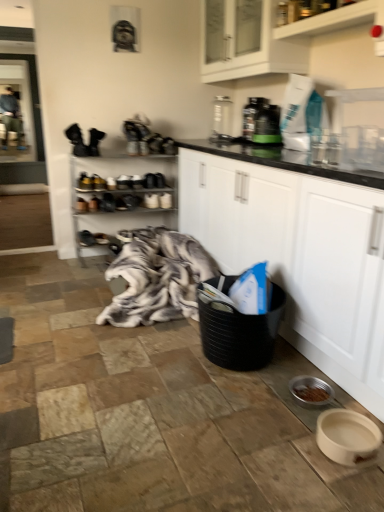
The height and width of the screenshot is (512, 384). Describe the element at coordinates (267, 125) in the screenshot. I see `green plastic bottle at upper center, arranged as the 2th appliance when viewed from the left` at that location.

You are a GUI agent. You are given a task and a screenshot of the screen. Output one action in this format:
    pyautogui.click(x=<x>, y=<y>)
    Task: Click on the white matte cabinet at center, arranged as the second cabinetry when viewed from the top
    
    Given the screenshot: What is the action you would take?
    pyautogui.click(x=298, y=253)

In order to face black woven laundry basket at lower center, should I rotate leftwards or rightwards?

Turn right approximately 7.427 degrees to face it.

The height and width of the screenshot is (512, 384). What do you see at coordinates (119, 197) in the screenshot?
I see `metallic silver shoe rack at center, placed as the first shelf when sorted from left to right` at bounding box center [119, 197].

Measure the distance between point (177, 276) and camera.

Point (177, 276) and camera are 2.68 meters apart from each other.

This screenshot has height=512, width=384. I want to click on green plastic bottle at upper center, marked as the first appliance in a front-to-back arrangement, so [x=267, y=125].

How many degrees apart are the facing directions of green plastic bottle at upper center, the 2th appliance viewed from the back, and clear glass screen door at upper left?

90.2 degrees separate the facing orientations of green plastic bottle at upper center, the 2th appliance viewed from the back, and clear glass screen door at upper left.

Would you consider green plastic bottle at upper center, arranged as the 2th appliance when viewed from the left, to be distant from clear glass screen door at upper left?

green plastic bottle at upper center, arranged as the 2th appliance when viewed from the left, is positioned a significant distance from clear glass screen door at upper left.

Where is `screen door above the green plastic bottle at upper center, marked as the first appliance in a front-to-back arrangement (from a real-world perspective)`? screen door above the green plastic bottle at upper center, marked as the first appliance in a front-to-back arrangement (from a real-world perspective) is located at coordinates pyautogui.click(x=16, y=112).

Does green plastic bottle at upper center, the 2th appliance viewed from the back, turn towards clear glass screen door at upper left?

No, green plastic bottle at upper center, the 2th appliance viewed from the back, is not oriented towards clear glass screen door at upper left.

Does black woven laundry basket at lower center come behind white glossy cabinet at upper center, positioned as the first cabinetry in top-to-bottom order?

No.

In the image, is black woven laundry basket at lower center on the left side or the right side of white glossy cabinet at upper center, positioned as the first cabinetry in top-to-bottom order?

Based on their positions, black woven laundry basket at lower center is located to the left of white glossy cabinet at upper center, positioned as the first cabinetry in top-to-bottom order.

Is black woven laundry basket at lower center next to white glossy cabinet at upper center, positioned as the first cabinetry in top-to-bottom order, and touching it?

No, black woven laundry basket at lower center is not touching white glossy cabinet at upper center, positioned as the first cabinetry in top-to-bottom order.

Does black woven laundry basket at lower center turn towards white glossy cabinet at upper center, positioned as the first cabinetry in top-to-bottom order?

No.

Consider the image. Which point is more forward, (222, 348) or (137, 287)?

The point (222, 348) is more forward.

In the image, is black woven laundry basket at lower center positioned in front of or behind fluffy gray blanket at center?

Visually, black woven laundry basket at lower center is located in front of fluffy gray blanket at center.

Can you tell me how much black woven laundry basket at lower center and fluffy gray blanket at center differ in facing direction?

black woven laundry basket at lower center and fluffy gray blanket at center are facing 12.9 degrees away from each other.

Would you say fluffy gray blanket at center is part of black woven laundry basket at lower center's contents?

Definitely not — fluffy gray blanket at center is not inside black woven laundry basket at lower center.

Is metallic silver shoe rack at center, placed as the first shelf when sorted from left to right, looking in the opposite direction of fluffy gray blanket at center?

That's not correct — metallic silver shoe rack at center, placed as the first shelf when sorted from left to right, is not looking away from fluffy gray blanket at center.

Based on the photo, from a real-world perspective, between metallic silver shoe rack at center, marked as the 2th shelf in a right-to-left arrangement, and fluffy gray blanket at center, who is vertically lower?

In real-world perspective, fluffy gray blanket at center is lower.

Considering the sizes of objects metallic silver shoe rack at center, which is the first shelf from back to front, and fluffy gray blanket at center in the image provided, who is bigger, metallic silver shoe rack at center, which is the first shelf from back to front, or fluffy gray blanket at center?

With larger size is fluffy gray blanket at center.

Is there a large distance between metallic silver shoe rack at center, marked as the 2th shelf in a right-to-left arrangement, and fluffy gray blanket at center?

No, metallic silver shoe rack at center, marked as the 2th shelf in a right-to-left arrangement, is not far away from fluffy gray blanket at center.

Is there a large distance between black woven laundry basket at lower center and green plastic bottle at upper center, marked as the first appliance in a front-to-back arrangement?

Yes, black woven laundry basket at lower center and green plastic bottle at upper center, marked as the first appliance in a front-to-back arrangement, are quite far apart.

Considering the sizes of objects black woven laundry basket at lower center and green plastic bottle at upper center, arranged as the 2th appliance when viewed from the left, in the image provided, who is bigger, black woven laundry basket at lower center or green plastic bottle at upper center, arranged as the 2th appliance when viewed from the left,?

Bigger between the two is black woven laundry basket at lower center.

Is black woven laundry basket at lower center taller or shorter than green plastic bottle at upper center, the 2th appliance viewed from the back?

In the image, black woven laundry basket at lower center appears to be taller than green plastic bottle at upper center, the 2th appliance viewed from the back.

Consider the image. Which of these two, white glossy shelf at upper center, the 1th shelf in the front-to-back sequence, or metallic silver shoe rack at center, placed as the first shelf when sorted from left to right, stands taller?

metallic silver shoe rack at center, placed as the first shelf when sorted from left to right.

Is white glossy shelf at upper center, the 1th shelf in the front-to-back sequence, behind metallic silver shoe rack at center, marked as the 2th shelf in a right-to-left arrangement?

No, white glossy shelf at upper center, the 1th shelf in the front-to-back sequence, is closer to the camera.

Is white glossy shelf at upper center, the 1th shelf in the front-to-back sequence, aimed at metallic silver shoe rack at center, placed as the first shelf when sorted from left to right?

No, white glossy shelf at upper center, the 1th shelf in the front-to-back sequence, is not aimed at metallic silver shoe rack at center, placed as the first shelf when sorted from left to right.

At what (x,y) coordinates should I click in order to perform the action: click on shelf behind the white glossy shelf at upper center, which is the second shelf from back to front. Please return your answer as a coordinate pair (x, y). Looking at the image, I should click on (119, 197).

Which is closer, (14,126) or (270,137)?

Point (14,126) is farther from the camera than point (270,137).

From the image's perspective, is clear glass screen door at upper left on green plastic bottle at upper center, marked as the first appliance in a front-to-back arrangement?

Indeed, from the image's perspective, clear glass screen door at upper left is shown above green plastic bottle at upper center, marked as the first appliance in a front-to-back arrangement.

The width and height of the screenshot is (384, 512). I want to click on the 2nd appliance directly beneath the clear glass screen door at upper left (from a real-world perspective), so click(x=267, y=125).

Does clear glass screen door at upper left have a smaller size compared to green plastic bottle at upper center, marked as the 1th appliance in a right-to-left arrangement?

No, clear glass screen door at upper left is not smaller than green plastic bottle at upper center, marked as the 1th appliance in a right-to-left arrangement.

Identify the location of screen door behind the green plastic bottle at upper center, arranged as the 2th appliance when viewed from the left. (16, 112).

At what (x,y) coordinates should I click in order to perform the action: click on laundry basket on the left of white glossy cabinet at upper center, positioned as the first cabinetry in top-to-bottom order. Please return your answer as a coordinate pair (x, y). Image resolution: width=384 pixels, height=512 pixels. Looking at the image, I should click on (240, 333).

Estimate the real-world distances between objects in this image. Which object is closer to clear glass screen door at upper left, metallic silver shoe rack at center, which is the first shelf from back to front, or white glossy shelf at upper center, the second shelf positioned from the left?

metallic silver shoe rack at center, which is the first shelf from back to front, lies closer to clear glass screen door at upper left than the other object.

Considering their positions, is black woven laundry basket at lower center positioned further to green plastic bottle at upper center, marked as the 1th appliance in a right-to-left arrangement, than fluffy gray blanket at center?

black woven laundry basket at lower center is positioned further to the anchor green plastic bottle at upper center, marked as the 1th appliance in a right-to-left arrangement.

Looking at the image, which one is located closer to fluffy gray blanket at center, clear glass screen door at upper left or white glossy shelf at upper center, which is the second shelf from back to front?

white glossy shelf at upper center, which is the second shelf from back to front, lies closer to fluffy gray blanket at center than the other object.

Looking at this image, based on their spatial positions, is green plastic bottle at upper center, marked as the first appliance in a front-to-back arrangement, or metallic gray coffee maker at upper center, acting as the 1th appliance starting from the back, further from metallic silver shoe rack at center, positioned as the second shelf in top-to-bottom order?

green plastic bottle at upper center, marked as the first appliance in a front-to-back arrangement, is further to metallic silver shoe rack at center, positioned as the second shelf in top-to-bottom order.

Which object lies nearer to the anchor point metallic silver shoe rack at center, placed as the first shelf when sorted from left to right, white matte cabinet at center, arranged as the second cabinetry when viewed from the top, or black woven laundry basket at lower center?

white matte cabinet at center, arranged as the second cabinetry when viewed from the top, is positioned closer to the anchor metallic silver shoe rack at center, placed as the first shelf when sorted from left to right.

When comparing their distances from white glossy cabinet at upper center, positioned as the first cabinetry in top-to-bottom order, does white matte cabinet at center, which is the 1th cabinetry from bottom to top, or metallic gray coffee maker at upper center, arranged as the 2th appliance when viewed from the right, seem further?

Based on the image, white matte cabinet at center, which is the 1th cabinetry from bottom to top, appears to be further to white glossy cabinet at upper center, positioned as the first cabinetry in top-to-bottom order.

Looking at this image, when comparing their distances from white glossy cabinet at upper center, positioned as the first cabinetry in top-to-bottom order, does green plastic bottle at upper center, marked as the 1th appliance in a right-to-left arrangement, or clear glass screen door at upper left seem further?

clear glass screen door at upper left is further to white glossy cabinet at upper center, positioned as the first cabinetry in top-to-bottom order.

When comparing their distances from white glossy cabinet at upper center, positioned as the first cabinetry in top-to-bottom order, does white glossy shelf at upper center, which is the second shelf from back to front, or white matte cabinet at center, arranged as the second cabinetry when viewed from the top, seem further?

white matte cabinet at center, arranged as the second cabinetry when viewed from the top, is further to white glossy cabinet at upper center, positioned as the first cabinetry in top-to-bottom order.

I want to click on shelf between white glossy shelf at upper center, the second shelf positioned from the left, and clear glass screen door at upper left from front to back, so click(119, 197).

Identify the location of cabinetry between white matte cabinet at center, arranged as the second cabinetry when viewed from the top, and metallic silver shoe rack at center, which is the first shelf from back to front, from front to back. (284, 42).

Where is `appliance between black woven laundry basket at lower center and metallic silver shoe rack at center, placed as the first shelf when sorted from left to right, along the z-axis`? The width and height of the screenshot is (384, 512). appliance between black woven laundry basket at lower center and metallic silver shoe rack at center, placed as the first shelf when sorted from left to right, along the z-axis is located at coordinates (267, 125).

Where is `appliance positioned between white glossy cabinet at upper center, the second cabinetry when ordered from bottom to top, and metallic gray coffee maker at upper center, arranged as the 2th appliance when viewed from the right, from near to far`? This screenshot has width=384, height=512. appliance positioned between white glossy cabinet at upper center, the second cabinetry when ordered from bottom to top, and metallic gray coffee maker at upper center, arranged as the 2th appliance when viewed from the right, from near to far is located at coordinates (267, 125).